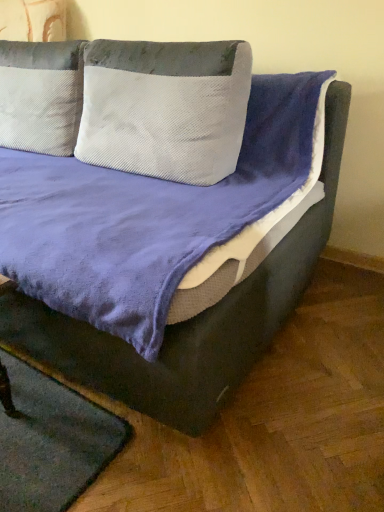
Question: Is white textured pillow at center aimed at green felt mat at lower left?

Choices:
 (A) yes
 (B) no

Answer: (B)

Question: From a real-world perspective, is white textured pillow at center on green felt mat at lower left?

Choices:
 (A) yes
 (B) no

Answer: (A)

Question: From the image's perspective, does white textured pillow at center appear lower than green felt mat at lower left?

Choices:
 (A) no
 (B) yes

Answer: (A)

Question: Are white textured pillow at center and green felt mat at lower left located far from each other?

Choices:
 (A) yes
 (B) no

Answer: (B)

Question: Is white textured pillow at center to the left of green felt mat at lower left from the viewer's perspective?

Choices:
 (A) yes
 (B) no

Answer: (B)

Question: Is white textured pillow at center positioned with its back to green felt mat at lower left?

Choices:
 (A) no
 (B) yes

Answer: (A)

Question: Is green felt mat at lower left beside velvet purple bed at center?

Choices:
 (A) yes
 (B) no

Answer: (B)

Question: From a real-world perspective, does green felt mat at lower left sit lower than velvet purple bed at center?

Choices:
 (A) yes
 (B) no

Answer: (A)

Question: From the image's perspective, is green felt mat at lower left on top of velvet purple bed at center?

Choices:
 (A) yes
 (B) no

Answer: (B)

Question: Can you confirm if green felt mat at lower left is positioned to the right of velvet purple bed at center?

Choices:
 (A) yes
 (B) no

Answer: (A)

Question: Is green felt mat at lower left thinner than velvet purple bed at center?

Choices:
 (A) yes
 (B) no

Answer: (A)

Question: Is green felt mat at lower left further to camera compared to velvet purple bed at center?

Choices:
 (A) yes
 (B) no

Answer: (A)

Question: Considering the relative positions of velvet purple bed at center and white textured pillow at center in the image provided, is velvet purple bed at center in front of white textured pillow at center?

Choices:
 (A) no
 (B) yes

Answer: (B)